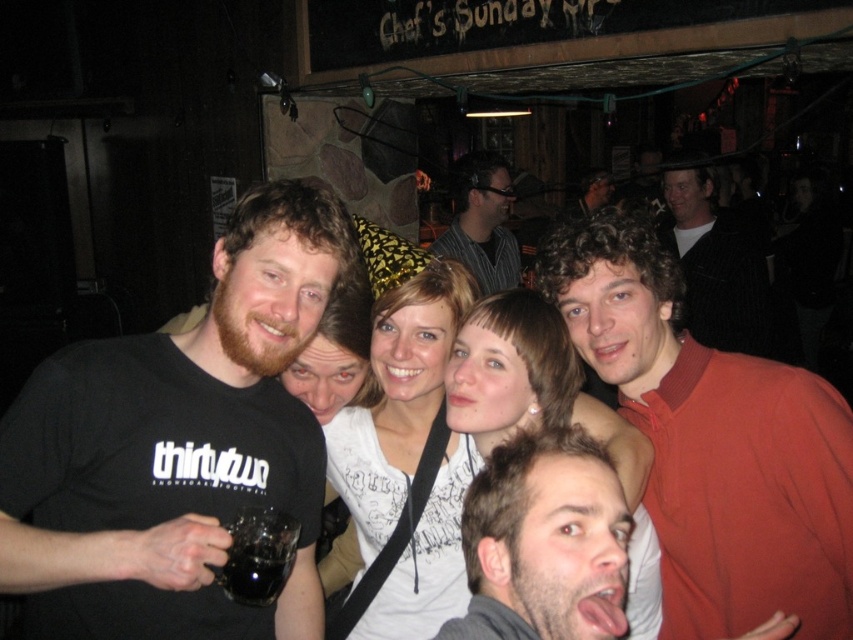
In the image, there are several people. The man on the far left is wearing a black T shirt with the text thirtytwo and holds a dark colored glass mug. Next to him is a woman with shoulder length brown hair wearing a white top with a graphic design and a black strap across her chest. There is also a point at coordinate (544, 541). What does this point indicate?

The point at coordinate (544, 541) indicates dark brown hair at center.